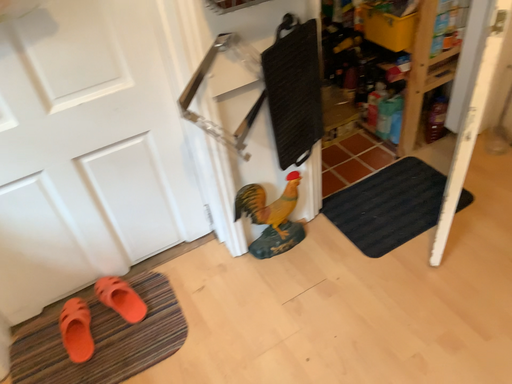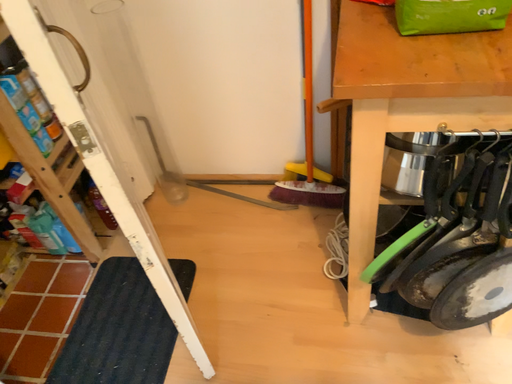
Question: How did the camera likely rotate when shooting the video?

Choices:
 (A) rotated left
 (B) rotated right

Answer: (B)